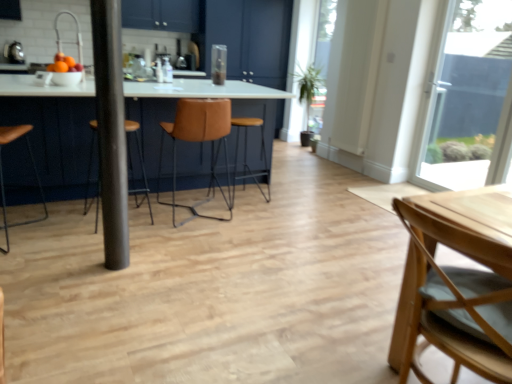
The image size is (512, 384). Find the location of `free location to the right of metallic pole at center`. free location to the right of metallic pole at center is located at coordinates (148, 262).